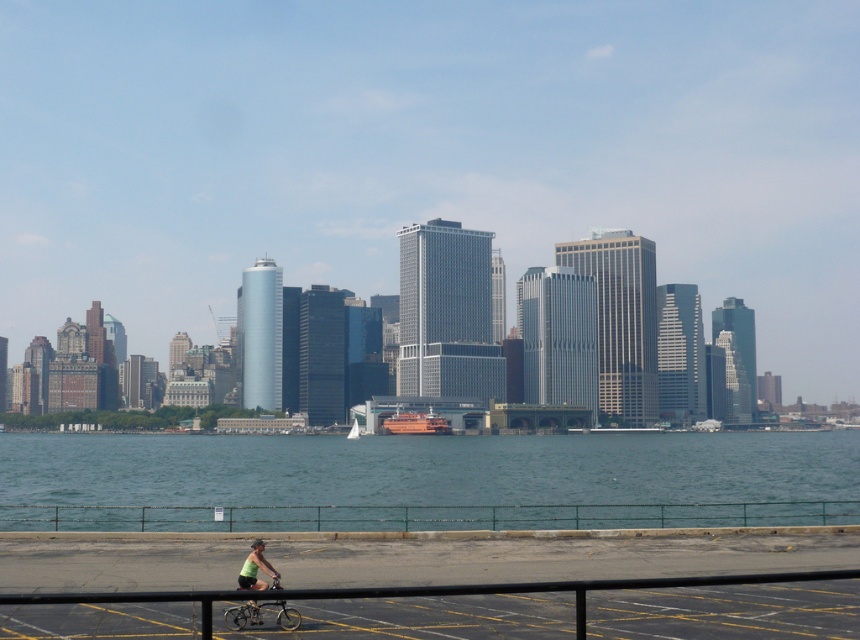
You are a photographer planning to capture the entire waterfront scene. Your camera can only focus on objects within a 100 cm width. Given the clear blue water at center and the green fabric shirt at lower center, which object will fill more of the camera frame?

The clear blue water at center will fill more of the camera frame because its width is larger than that of the green fabric shirt at lower center.

You are a delivery drone operator. Your drone is currently hovering at the center of the image. You need to deliver a package to the silver metallic bicycle at lower left. What direction should you move the drone to reach the bicycle?

The silver metallic bicycle at lower left is located at point (260,614) in the image. Since the drone is at the center, it should move downward and to the left to reach the bicycle.

You are a drone operator trying to fly a drone from point A to point B in the urban waterfront scene. The points are labeled as point (52, 442) and point (261, 547). According to the scene description, which point is closer to the skyscrapers?

Point (52, 442) is behind point (261, 547), so point (52, 442) is closer to the skyscrapers since it is positioned further back in the scene.